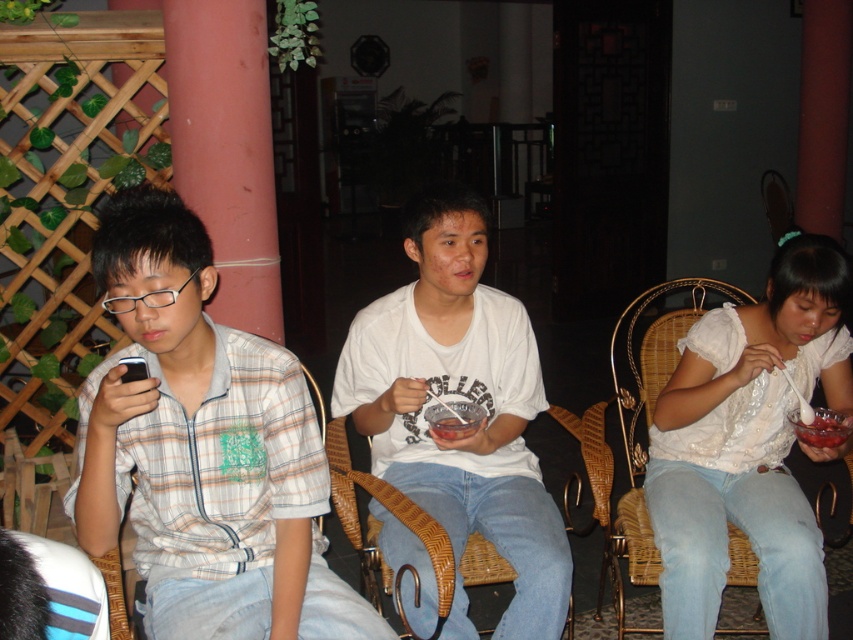
Question: Does plaid shirt at left have a larger size compared to woven wicker chair at center?

Choices:
 (A) yes
 (B) no

Answer: (A)

Question: Estimate the real-world distances between objects in this image. Which object is farther from the woven rattan chair at lower left?

Choices:
 (A) plaid shirt at left
 (B) woven wicker chair at center

Answer: (B)

Question: Is plaid shirt at left thinner than woven wicker chair at right?

Choices:
 (A) no
 (B) yes

Answer: (A)

Question: Among these objects, which one is farthest from the camera?

Choices:
 (A) woven wicker chair at center
 (B) woven wicker chair at right
 (C) red matte column at left
 (D) woven rattan chair at lower left

Answer: (C)

Question: Does woven wicker chair at right have a greater width compared to red matte column at left?

Choices:
 (A) no
 (B) yes

Answer: (B)

Question: Estimate the real-world distances between objects in this image. Which object is farther from the red matte column at left?

Choices:
 (A) woven rattan chair at lower left
 (B) plaid shirt at left
 (C) woven wicker chair at center
 (D) woven wicker chair at right

Answer: (A)